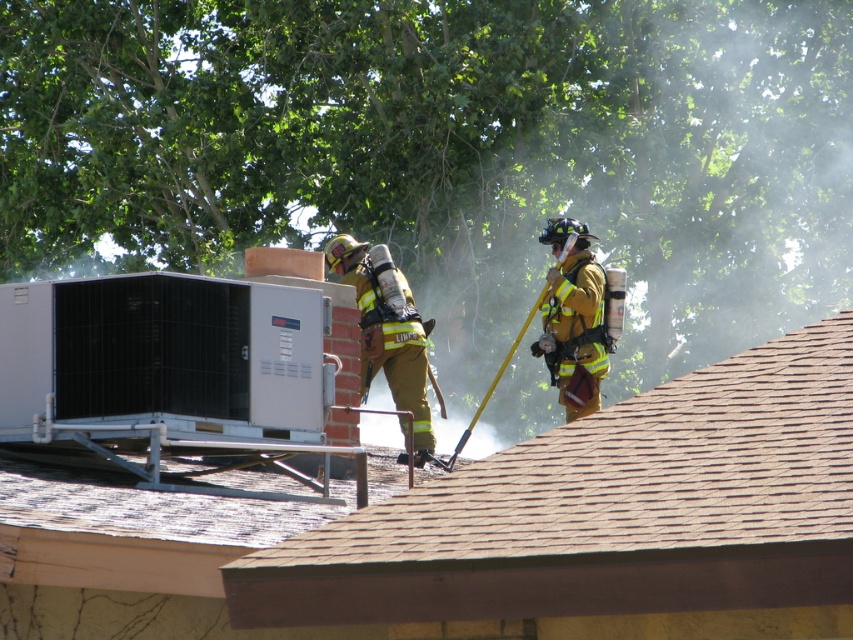
Question: Can you confirm if brown shingles at upper center is positioned to the left of reflective gold helmet at upper right?

Choices:
 (A) no
 (B) yes

Answer: (B)

Question: Which point appears farthest from the camera in this image?

Choices:
 (A) (392, 388)
 (B) (555, 344)
 (C) (590, 477)

Answer: (B)

Question: Among these points, which one is nearest to the camera?

Choices:
 (A) (363, 355)
 (B) (561, 282)

Answer: (A)

Question: Which point is farther to the camera?

Choices:
 (A) (679, 486)
 (B) (590, 337)

Answer: (B)

Question: Is firefighter yellow uniform at center smaller than reflective gold helmet at upper right?

Choices:
 (A) yes
 (B) no

Answer: (B)

Question: Is brown shingles at upper center to the left of reflective gold helmet at upper right from the viewer's perspective?

Choices:
 (A) no
 (B) yes

Answer: (B)